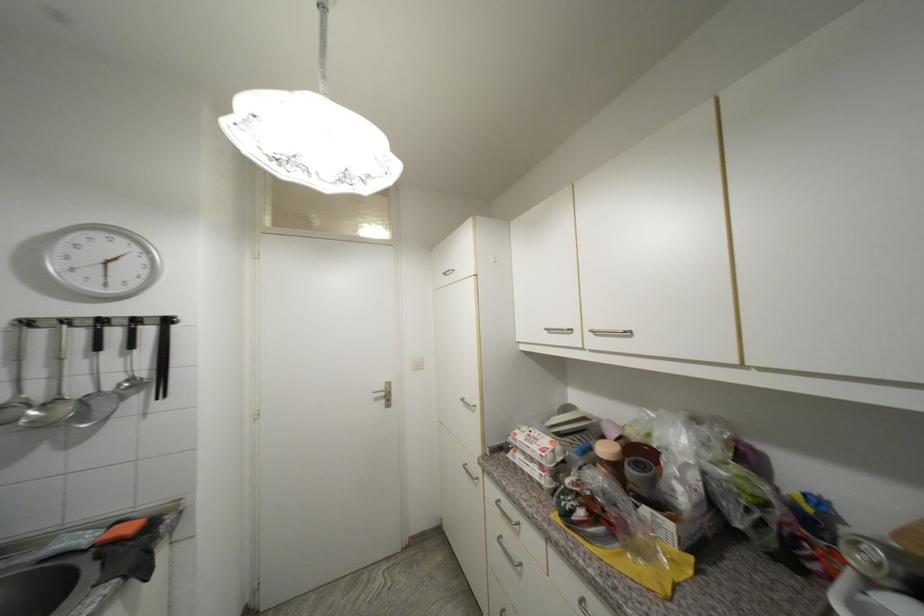
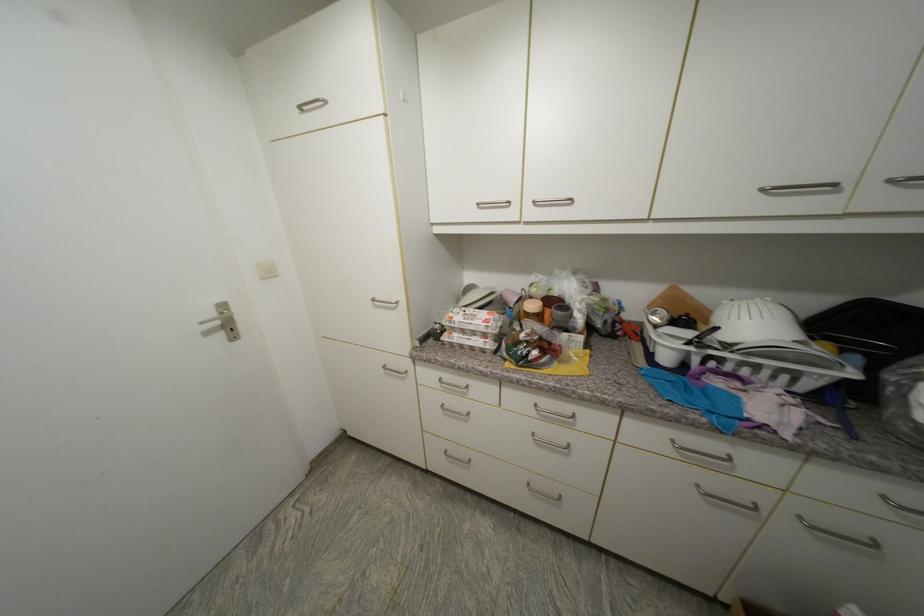
The point at (521, 436) is marked in the first image. Where is the corresponding point in the second image?

(457, 318)